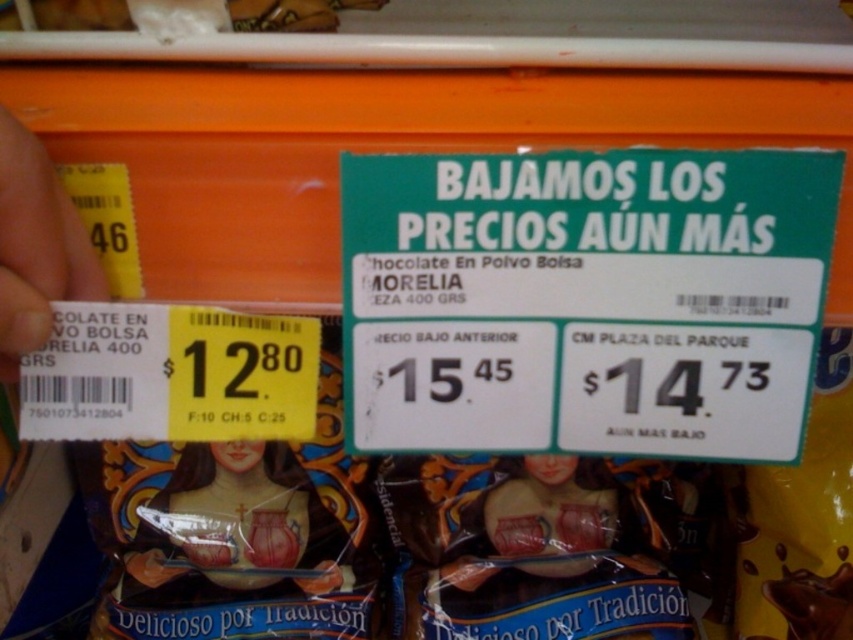
Question: Among these objects, which one is nearest to the camera?

Choices:
 (A) yellow paper at left
 (B) matte brown statue at center
 (C) matte plastic doll at center

Answer: (A)

Question: Estimate the real-world distances between objects in this image. Which object is closer to the yellow paper at left?

Choices:
 (A) matte brown statue at center
 (B) matte plastic doll at center

Answer: (A)

Question: Among these points, which one is farthest from the camera?

Choices:
 (A) (28, 348)
 (B) (519, 493)
 (C) (251, 525)

Answer: (B)

Question: Does matte brown statue at center lie in front of yellow paper at left?

Choices:
 (A) no
 (B) yes

Answer: (A)

Question: Does matte brown statue at center appear on the left side of matte plastic doll at center?

Choices:
 (A) no
 (B) yes

Answer: (B)

Question: Does matte brown statue at center have a larger size compared to matte plastic doll at center?

Choices:
 (A) yes
 (B) no

Answer: (A)